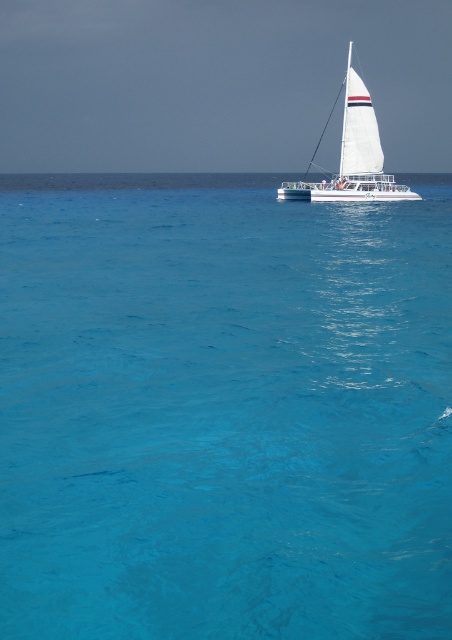
Question: Is the position of transparent blue water at center less distant than that of white sailboat at center?

Choices:
 (A) no
 (B) yes

Answer: (B)

Question: Can you confirm if transparent blue water at center is positioned above white sailboat at center?

Choices:
 (A) yes
 (B) no

Answer: (B)

Question: Which object appears closest to the camera in this image?

Choices:
 (A) white sailboat at center
 (B) transparent blue water at center

Answer: (B)

Question: Is transparent blue water at center wider than white sailboat at center?

Choices:
 (A) no
 (B) yes

Answer: (B)

Question: Among these points, which one is farthest from the camera?

Choices:
 (A) (179, 432)
 (B) (348, 129)

Answer: (B)